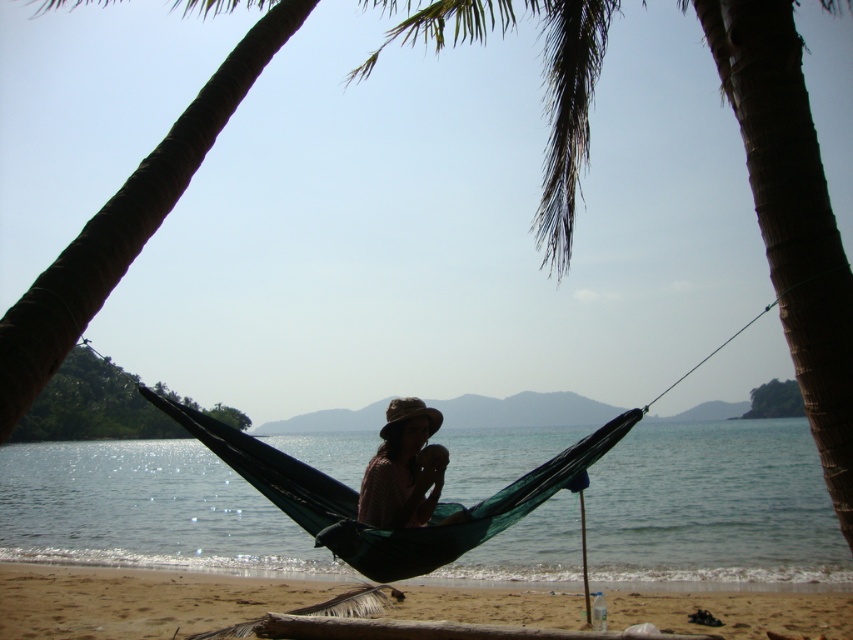
Question: Does green water at center appear on the right side of sandy beach at lower center?

Choices:
 (A) no
 (B) yes

Answer: (B)

Question: Where is green water at center located in relation to plaid fabric person at center in the image?

Choices:
 (A) left
 (B) right

Answer: (B)

Question: Does sandy beach at lower center have a greater width compared to plaid fabric person at center?

Choices:
 (A) no
 (B) yes

Answer: (B)

Question: Which point is closer to the camera taking this photo?

Choices:
 (A) (639, 616)
 (B) (724, 467)
 (C) (383, 492)

Answer: (C)

Question: Which of the following is the farthest from the observer?

Choices:
 (A) (254, 563)
 (B) (16, 593)

Answer: (A)

Question: Which object is the closest to the plaid fabric person at center?

Choices:
 (A) green water at center
 (B) sandy beach at lower center

Answer: (B)